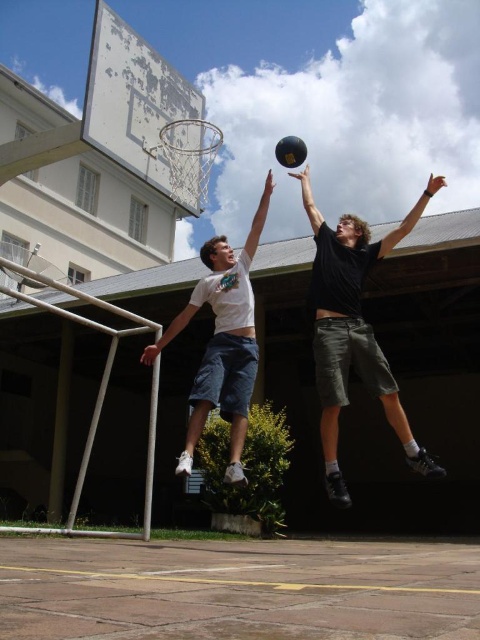
You are a photographer trying to capture a closeup of the black matte basketball at center and the white matte shorts at center. Since you want both objects to appear the same size in your photo, which object should you move closer to the camera?

The black matte basketball at center is bigger than the white matte shorts at center. To make them appear the same size in the photo, you should move the white matte shorts at center closer to the camera because it is smaller and needs to be magnified more.

You are a spectator watching the basketball game and want to know which object is nearer to you between the black matte basketball at center and the white matte shorts at center. Can you tell me?

The black matte basketball at center is closer to the viewer than the white matte shorts at center.